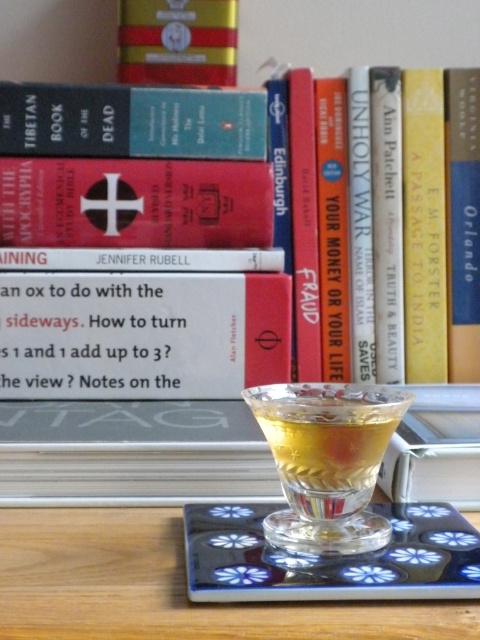
You are a guest at a gathering and want to reach for the wooden table at center without disturbing the matte red book at center. Which direction should you approach from?

You should approach from below the wooden table at center since the matte red book at center is above it and won not be disturbed by moving from that direction.

You are a guest at a gathering and want to place a small gift on the wooden table at center. However, there is a hardcover book at upper center nearby. Which object should you place the gift on to ensure it is visible to everyone in the room?

You should place the gift on the wooden table at center because it is closer to the viewer than the hardcover book at upper center, making it more visible to everyone in the room.